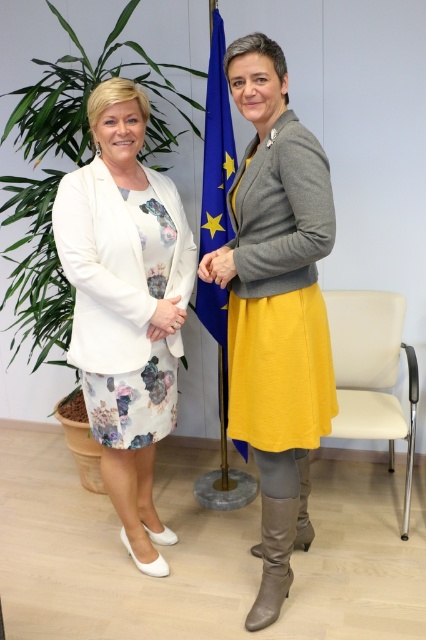
Question: Does matte gray sweater at center appear on the right side of floral fabric dress at left?

Choices:
 (A) no
 (B) yes

Answer: (B)

Question: Which point is closer to the camera taking this photo?

Choices:
 (A) (141, 195)
 (B) (224, 116)
 (C) (252, 284)

Answer: (C)

Question: Can you confirm if matte gray sweater at center is positioned above matte white hand at center?

Choices:
 (A) yes
 (B) no

Answer: (B)

Question: Estimate the real-world distances between objects in this image. Which object is farther from the leather boot at lower center?

Choices:
 (A) matte white hand at center
 (B) blue fabric flag at center

Answer: (A)

Question: Is leather high-heeled boot at lower center below matte white hand at center?

Choices:
 (A) no
 (B) yes

Answer: (B)

Question: Which object is farther from the camera taking this photo?

Choices:
 (A) floral fabric dress at left
 (B) matte yellow skirt at center

Answer: (A)